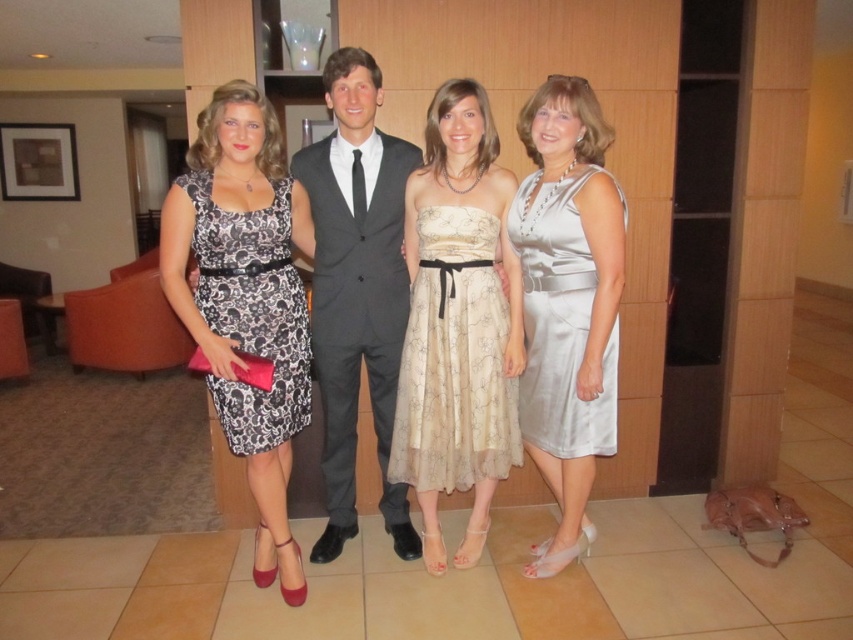
Identify the location of matte gray suit at center. (357, 291).

Can you confirm if matte gray suit at center is shorter than beige floral chiffon dress at center?

In fact, matte gray suit at center may be taller than beige floral chiffon dress at center.

This screenshot has width=853, height=640. What are the coordinates of `matte gray suit at center` in the screenshot? It's located at (357, 291).

I want to click on black lace dress at left, so click(x=252, y=312).

Between point (198, 276) and point (561, 403), which one is positioned behind?

The point (198, 276) is more distant.

The height and width of the screenshot is (640, 853). Identify the location of black lace dress at left. (252, 312).

Which of these two, matte gray suit at center or black lace dress at left, stands shorter?

With less height is black lace dress at left.

What do you see at coordinates (357, 291) in the screenshot? I see `matte gray suit at center` at bounding box center [357, 291].

The height and width of the screenshot is (640, 853). In order to click on matte gray suit at center in this screenshot , I will do `click(357, 291)`.